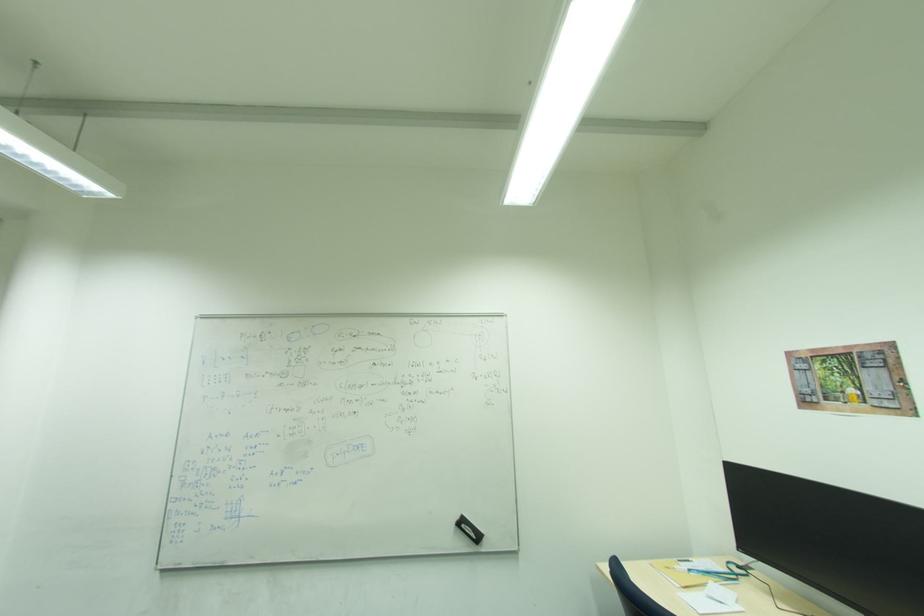
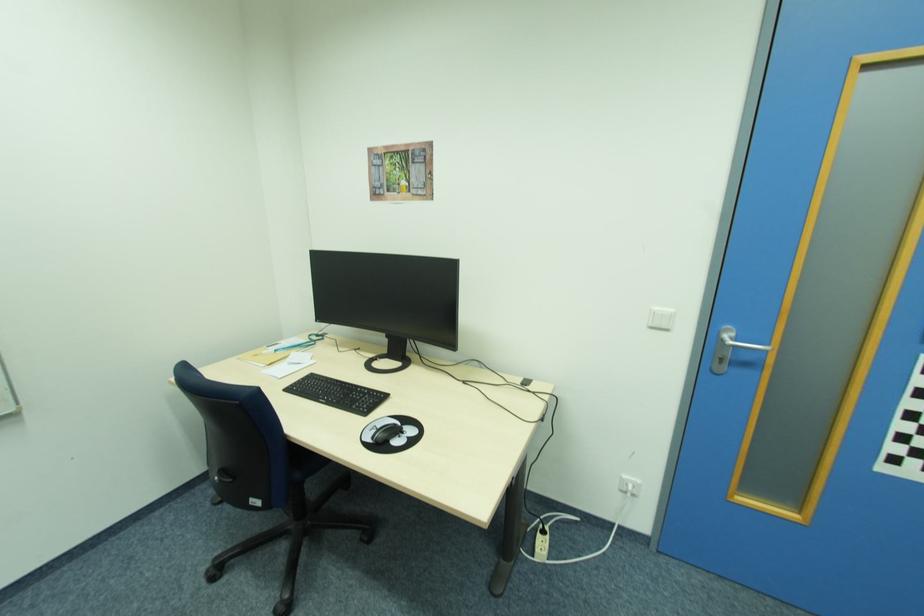
The first image is from the beginning of the video and the second image is from the end. How did the camera likely rotate when shooting the video?

The camera rotated toward right-down.